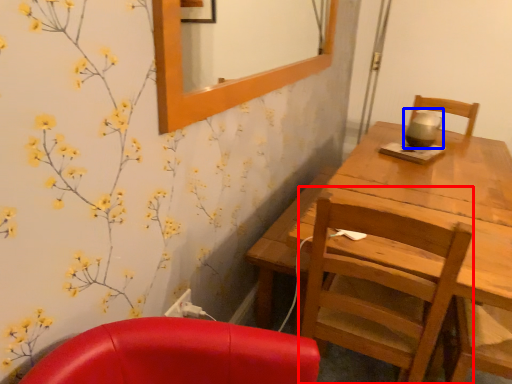
Question: Among these objects, which one is nearest to the camera, chair (highlighted by a red box) or tea pot (highlighted by a blue box)?

Choices:
 (A) chair
 (B) tea pot

Answer: (A)